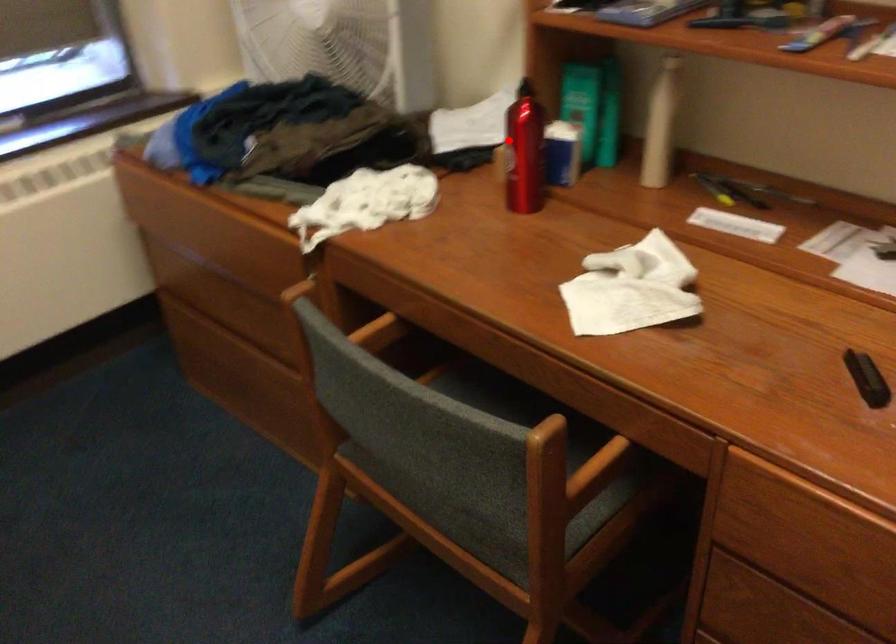
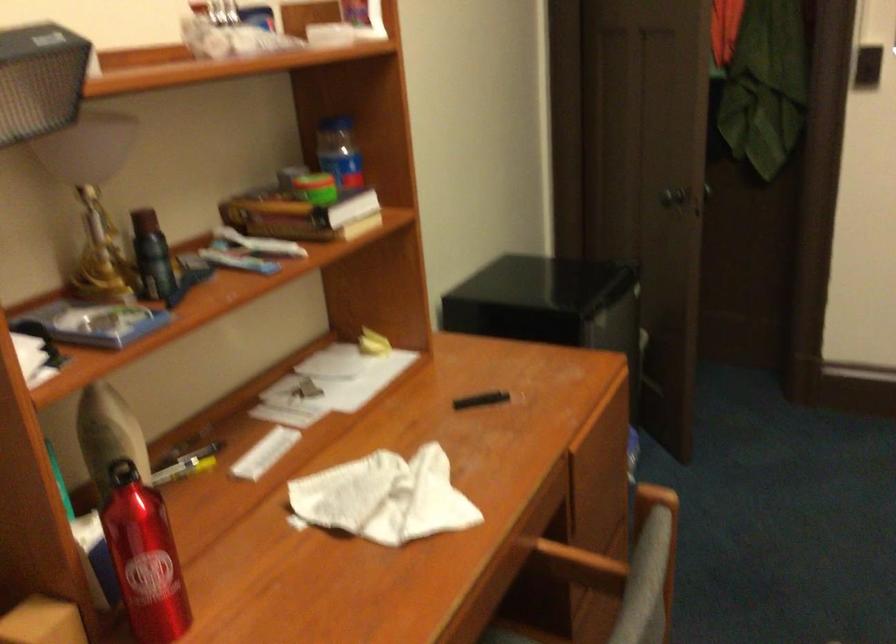
Locate, in the second image, the point that corresponds to the highlighted location in the first image.

(143, 558)